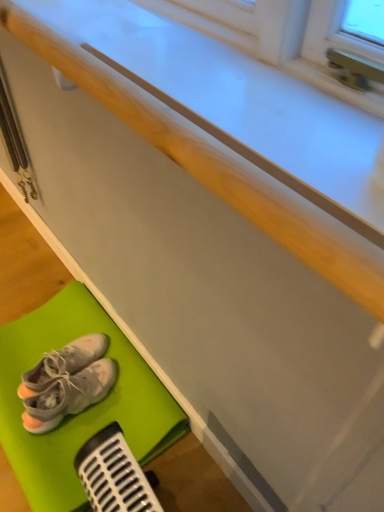
Image resolution: width=384 pixels, height=512 pixels. I want to click on vacant area in front of white fabric sneakers at lower left, which appears as the second footwear when viewed from the top, so click(58, 453).